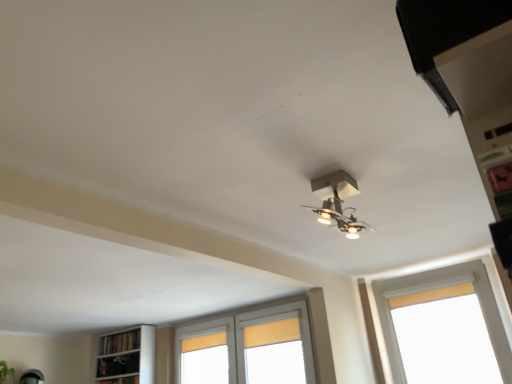
Question: In which direction should I rotate to look at white wooden window at center, positioned as the second window in right-to-left order?

Choices:
 (A) left
 (B) right

Answer: (A)

Question: Is white painted wood window at right, the 2th window from the back, bigger than wooden bookshelf at lower left?

Choices:
 (A) no
 (B) yes

Answer: (B)

Question: From a real-world perspective, does white painted wood window at right, which is the first window in front-to-back order, sit lower than wooden bookshelf at lower left?

Choices:
 (A) no
 (B) yes

Answer: (B)

Question: Is white painted wood window at right, arranged as the 1th window when viewed from the right, in contact with wooden bookshelf at lower left?

Choices:
 (A) no
 (B) yes

Answer: (A)

Question: From a real-world perspective, is white painted wood window at right, the 2th window from the back, physically above wooden bookshelf at lower left?

Choices:
 (A) yes
 (B) no

Answer: (B)

Question: Does white painted wood window at right, the 2th window from the back, come in front of wooden bookshelf at lower left?

Choices:
 (A) no
 (B) yes

Answer: (B)

Question: Does black matte exhaust hood at upper right appear on the left side of wooden bookshelf at lower left?

Choices:
 (A) no
 (B) yes

Answer: (A)

Question: Does black matte exhaust hood at upper right have a lesser width compared to wooden bookshelf at lower left?

Choices:
 (A) no
 (B) yes

Answer: (A)

Question: Does black matte exhaust hood at upper right have a larger size compared to wooden bookshelf at lower left?

Choices:
 (A) yes
 (B) no

Answer: (B)

Question: Does black matte exhaust hood at upper right have a lesser height compared to wooden bookshelf at lower left?

Choices:
 (A) yes
 (B) no

Answer: (A)

Question: From the image's perspective, would you say black matte exhaust hood at upper right is shown under wooden bookshelf at lower left?

Choices:
 (A) yes
 (B) no

Answer: (B)

Question: Is black matte exhaust hood at upper right looking in the opposite direction of wooden bookshelf at lower left?

Choices:
 (A) no
 (B) yes

Answer: (A)

Question: Could you tell me if black matte exhaust hood at upper right is turned towards white painted wood window at right, the 2th window in the left-to-right sequence?

Choices:
 (A) yes
 (B) no

Answer: (B)